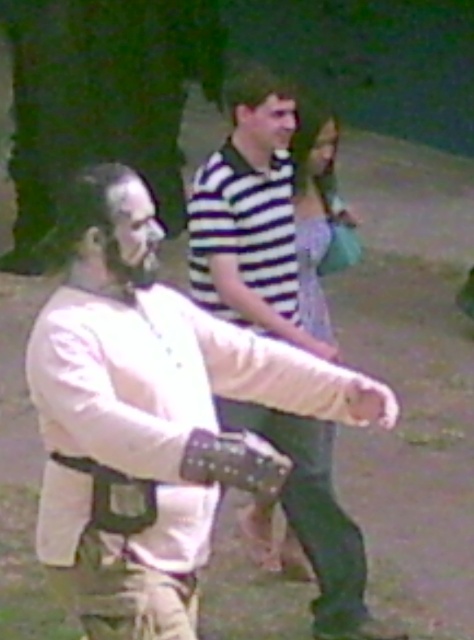
You are standing at the point with coordinates point (267,100) and want to walk towards the point with coordinates point (166,356). Based on the scene description, will you be moving towards the foreground or background of the image?

Based on the scene description, point (166,356) is in front of point (267,100). Therefore, moving from point (267,100) towards point (166,356) would mean moving towards the foreground of the image.

You are standing at the point with coordinates point (324, 148) and want to move to the point with coordinates point (279, 132). Which direction should you move in?

You should move towards the point (279, 132) which is in front of point (324, 148).

You are a photographer trying to capture a clear shot of the person in the white outfit. You notice the matte white mask at center and the smooth skin face at center. Which one is positioned lower in the image?

The matte white mask at center is located below the smooth skin face at center, so the matte white mask at center is positioned lower in the image.